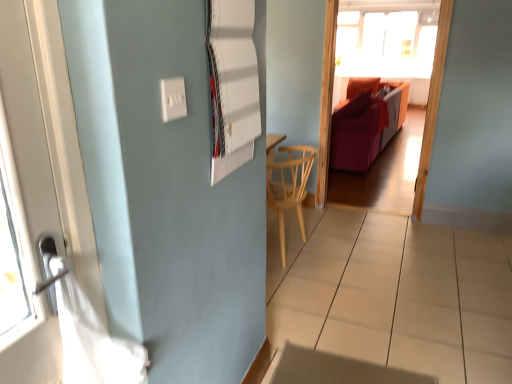
This screenshot has width=512, height=384. Identify the location of vacant area that lies in front of velvet orange couch at center. (388, 229).